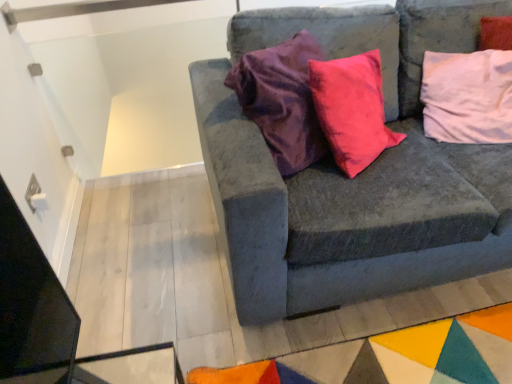
Question: In terms of width, does velvet gray couch at center look wider or thinner when compared to pink fabric pillow at upper right?

Choices:
 (A) thin
 (B) wide

Answer: (B)

Question: In the image, is velvet gray couch at center on the left side or the right side of pink fabric pillow at upper right?

Choices:
 (A) left
 (B) right

Answer: (A)

Question: From their relative heights in the image, would you say velvet gray couch at center is taller or shorter than pink fabric pillow at upper right?

Choices:
 (A) short
 (B) tall

Answer: (B)

Question: Is pink fabric pillow at upper right taller or shorter than velvet gray couch at center?

Choices:
 (A) tall
 (B) short

Answer: (B)

Question: Would you say pink fabric pillow at upper right is inside or outside velvet gray couch at center?

Choices:
 (A) inside
 (B) outside

Answer: (A)

Question: Considering the positions of point (449, 137) and point (416, 225), is point (449, 137) closer or farther from the camera than point (416, 225)?

Choices:
 (A) farther
 (B) closer

Answer: (A)

Question: Relative to velvet gray couch at center, is pink fabric pillow at upper right in front or behind?

Choices:
 (A) behind
 (B) front

Answer: (A)